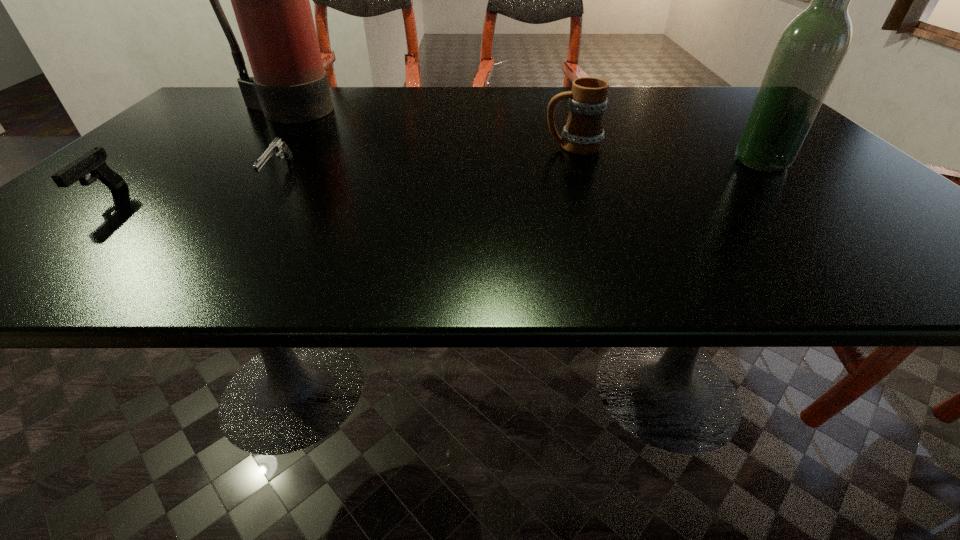
You are a GUI agent. You are given a task and a screenshot of the screen. Output one action in this format:
    pyautogui.click(x=<x>, y=<y>)
    Task: Click on the free space that satisfies the following two spatial constraints: 1. on the side of the third tallest object with the handle; 2. on the front-facing side of the right pistol
    The width and height of the screenshot is (960, 540).
    Given the screenshot: What is the action you would take?
    pyautogui.click(x=583, y=175)

Locate an element on the screen. This screenshot has height=540, width=960. free region that satisfies the following two spatial constraints: 1. on the side of the third shortest object with the handle; 2. on the right side of the liquor is located at coordinates (578, 162).

The image size is (960, 540). I want to click on free space that satisfies the following two spatial constraints: 1. on the side of the third tallest object with the handle; 2. on the front-facing side of the shortest object, so click(583, 175).

Locate an element on the screen. This screenshot has height=540, width=960. vacant space that satisfies the following two spatial constraints: 1. on the side of the fourth object from left to right with the handle; 2. on the front-facing side of the shortest object is located at coordinates (583, 175).